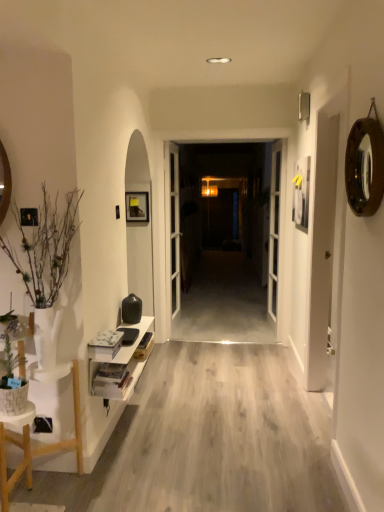
Question: Considering the relative sizes of white glossy door at center, which appears as the first door when viewed from the left, and white textured stool at lower left in the image provided, is white glossy door at center, which appears as the first door when viewed from the left, thinner than white textured stool at lower left?

Choices:
 (A) yes
 (B) no

Answer: (B)

Question: Is white glossy door at center, marked as the second door in a right-to-left arrangement, aimed at white textured stool at lower left?

Choices:
 (A) no
 (B) yes

Answer: (A)

Question: Is white glossy door at center, which appears as the first door when viewed from the left, behind white textured stool at lower left?

Choices:
 (A) yes
 (B) no

Answer: (A)

Question: Can we say white glossy door at center, marked as the second door in a right-to-left arrangement, lies outside white textured stool at lower left?

Choices:
 (A) no
 (B) yes

Answer: (B)

Question: Does white glossy door at center, marked as the second door in a right-to-left arrangement, have a larger size compared to white textured stool at lower left?

Choices:
 (A) no
 (B) yes

Answer: (A)

Question: From a real-world perspective, is white glossy shelf at lower left above or below light wood floor at center?

Choices:
 (A) below
 (B) above

Answer: (B)

Question: Based on their sizes in the image, would you say white glossy shelf at lower left is bigger or smaller than light wood floor at center?

Choices:
 (A) big
 (B) small

Answer: (B)

Question: From the image's perspective, is white glossy shelf at lower left located above or below light wood floor at center?

Choices:
 (A) above
 (B) below

Answer: (A)

Question: Looking at their shapes, would you say white glossy shelf at lower left is wider or thinner than light wood floor at center?

Choices:
 (A) wide
 (B) thin

Answer: (B)

Question: Is gold metallic mirror at upper right wider or thinner than white matte vase at left?

Choices:
 (A) wide
 (B) thin

Answer: (B)

Question: From a real-world perspective, relative to white matte vase at left, is gold metallic mirror at upper right vertically above or below?

Choices:
 (A) below
 (B) above

Answer: (B)

Question: Considering the relative positions of gold metallic mirror at upper right and white matte vase at left in the image provided, is gold metallic mirror at upper right to the left or to the right of white matte vase at left?

Choices:
 (A) right
 (B) left

Answer: (A)

Question: From the image's perspective, is gold metallic mirror at upper right above or below white matte vase at left?

Choices:
 (A) below
 (B) above

Answer: (B)

Question: Considering the positions of point (294, 450) and point (276, 289), is point (294, 450) closer or farther from the camera than point (276, 289)?

Choices:
 (A) farther
 (B) closer

Answer: (B)

Question: Considering the positions of light wood floor at center and white glass door at center, the second door positioned from the left, in the image, is light wood floor at center taller or shorter than white glass door at center, the second door positioned from the left,?

Choices:
 (A) short
 (B) tall

Answer: (A)